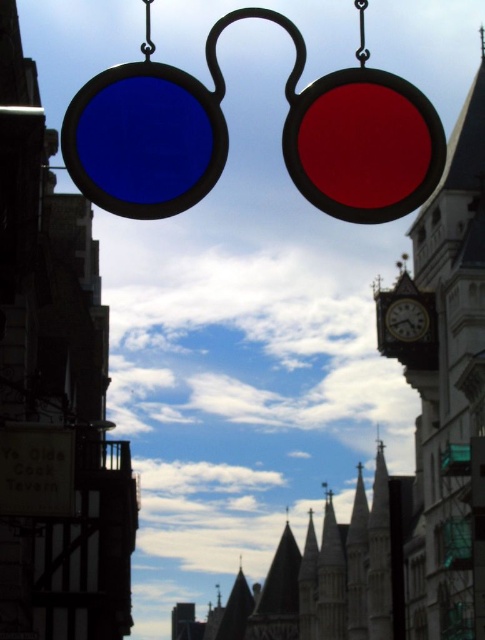
Is smooth stone clock tower at right taller than wooden clock at center?

Correct, smooth stone clock tower at right is much taller as wooden clock at center.

Does smooth stone clock tower at right lie in front of wooden clock at center?

Yes.

Locate an element on the screen. Image resolution: width=485 pixels, height=640 pixels. smooth stone clock tower at right is located at coordinates (443, 400).